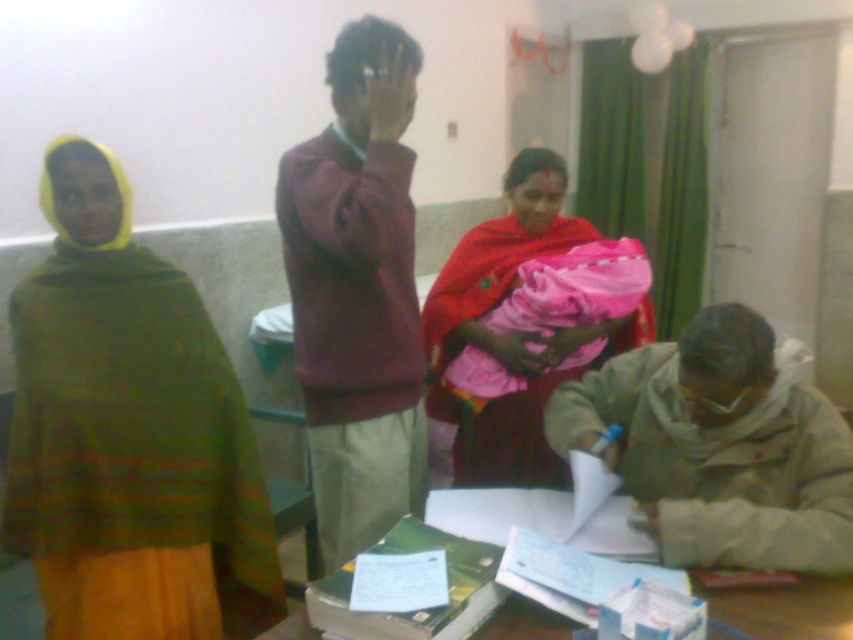
You are a photographer setting up a shoot in this room. You need to position a light source so that it illuminates both the maroon sweater at center and the beige fabric jacket at lower right. Based on their positions, where should you place the light source relative to these objects?

The maroon sweater at center is above the beige fabric jacket at lower right, so placing the light source above the jacket would allow it to illuminate both objects effectively.